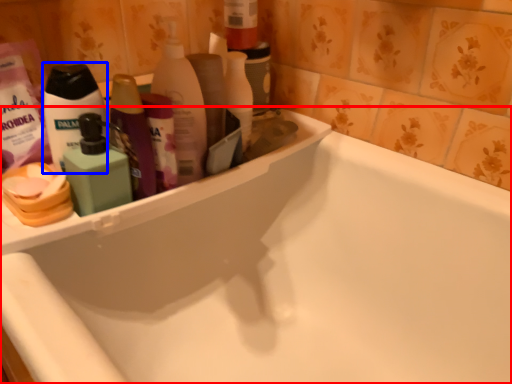
Question: Which point is further to the camera, bathtub (highlighted by a red box) or toiletry (highlighted by a blue box)?

Choices:
 (A) bathtub
 (B) toiletry

Answer: (B)